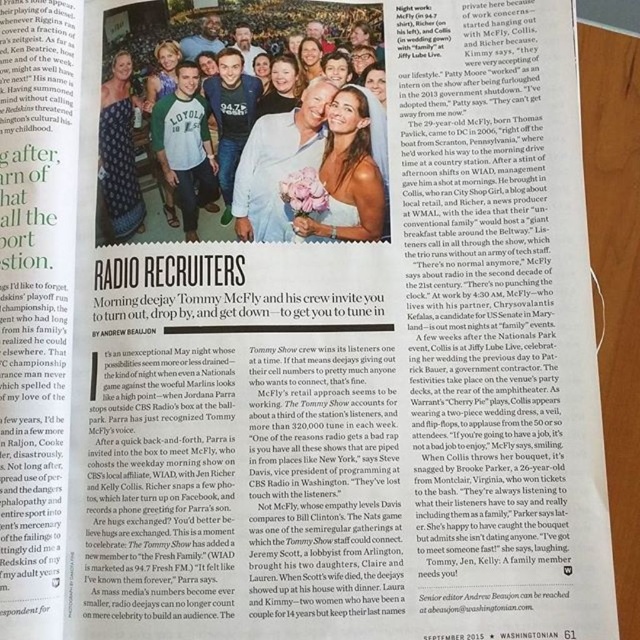
Question: Among these points, which one is farthest from the camera?

Choices:
 (A) (129, 118)
 (B) (284, 132)
 (C) (184, 148)

Answer: (A)

Question: Among these objects, which one is farthest from the camera?

Choices:
 (A) matte green t-shirt at center
 (B) blue denim dress at upper left
 (C) matte brown hair at center
 (D) green jersey at center

Answer: (B)

Question: Among these points, which one is nearest to the camera?

Choices:
 (A) (163, 104)
 (B) (337, 92)
 (C) (112, 140)

Answer: (B)

Question: Is green jersey at center below blue denim dress at upper left?

Choices:
 (A) yes
 (B) no

Answer: (A)

Question: Can you confirm if matte green t-shirt at center is wider than green jersey at center?

Choices:
 (A) no
 (B) yes

Answer: (B)

Question: Can you confirm if matte green t-shirt at center is bigger than matte gold necklace at center?

Choices:
 (A) yes
 (B) no

Answer: (A)